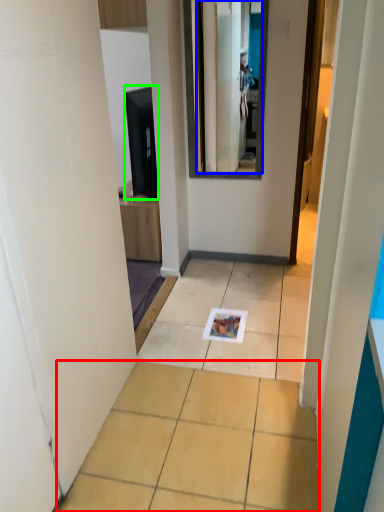
Question: Which object is the closest to the ceramic tile (highlighted by a red box)? Choose among these: mirror (highlighted by a blue box) or appliance (highlighted by a green box).

Choices:
 (A) mirror
 (B) appliance

Answer: (B)